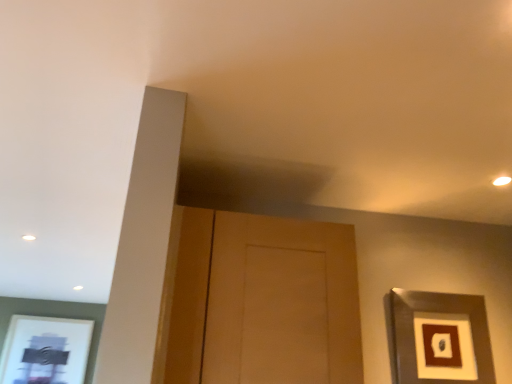
The height and width of the screenshot is (384, 512). Describe the element at coordinates (440, 338) in the screenshot. I see `metallic silver picture frame at upper right` at that location.

The width and height of the screenshot is (512, 384). Find the location of `metallic silver picture frame at upper right`. metallic silver picture frame at upper right is located at coordinates (440, 338).

Measure the distance between point (275, 239) and camera.

Point (275, 239) is 4.26 feet away from camera.

I want to click on wooden door at center, so [282, 302].

The image size is (512, 384). What do you see at coordinates (282, 302) in the screenshot? I see `wooden door at center` at bounding box center [282, 302].

Find the location of a particular element. metallic silver picture frame at upper right is located at coordinates (440, 338).

Does wooden door at center appear on the right side of metallic silver picture frame at upper right?

No, wooden door at center is not to the right of metallic silver picture frame at upper right.

Considering the positions of objects wooden door at center and metallic silver picture frame at upper right in the image provided, who is behind, wooden door at center or metallic silver picture frame at upper right?

Positioned behind is metallic silver picture frame at upper right.

Which is in front, point (285, 360) or point (395, 345)?

The point (285, 360) is more forward.

From the image's perspective, which is below, wooden door at center or metallic silver picture frame at upper right?

metallic silver picture frame at upper right is shown below in the image.

From a real-world perspective, is wooden door at center on metallic silver picture frame at upper right?

Yes.

Which object is wider, wooden door at center or metallic silver picture frame at upper right?

wooden door at center is wider.

Which of these two, wooden door at center or metallic silver picture frame at upper right, stands taller?

wooden door at center is taller.

Considering the relative sizes of wooden door at center and metallic silver picture frame at upper right in the image provided, is wooden door at center smaller than metallic silver picture frame at upper right?

No.

Is metallic silver picture frame at upper right inside wooden door at center?

No, wooden door at center does not contain metallic silver picture frame at upper right.

Are wooden door at center and metallic silver picture frame at upper right beside each other?

wooden door at center is not next to metallic silver picture frame at upper right, and they're not touching.

Is wooden door at center looking in the opposite direction of metallic silver picture frame at upper right?

No, metallic silver picture frame at upper right is not at the back of wooden door at center.

How many degrees apart are the facing directions of wooden door at center and metallic silver picture frame at upper right?

They differ by 1.3 degrees in their facing directions.

This screenshot has width=512, height=384. In order to click on picture frame on the right of wooden door at center in this screenshot , I will do `click(440, 338)`.

Looking at this image, is metallic silver picture frame at upper right to the right of wooden door at center from the viewer's perspective?

Indeed, metallic silver picture frame at upper right is positioned on the right side of wooden door at center.

Considering the positions of objects metallic silver picture frame at upper right and wooden door at center in the image provided, who is in front, metallic silver picture frame at upper right or wooden door at center?

wooden door at center is closer to the camera.

Is point (411, 339) closer to camera compared to point (350, 334)?

That is False.

From the image's perspective, which is above, metallic silver picture frame at upper right or wooden door at center?

wooden door at center, from the image's perspective.

From a real-world perspective, is metallic silver picture frame at upper right physically located above or below wooden door at center?

metallic silver picture frame at upper right is situated lower than wooden door at center in the real world.

Which object is wider, metallic silver picture frame at upper right or wooden door at center?

With larger width is wooden door at center.

Considering the sizes of objects metallic silver picture frame at upper right and wooden door at center in the image provided, who is shorter, metallic silver picture frame at upper right or wooden door at center?

metallic silver picture frame at upper right.

Can you confirm if metallic silver picture frame at upper right is bigger than wooden door at center?

Actually, metallic silver picture frame at upper right might be smaller than wooden door at center.

Do you think metallic silver picture frame at upper right is within wooden door at center, or outside of it?

The correct answer is: outside.

Does metallic silver picture frame at upper right touch wooden door at center?

No, metallic silver picture frame at upper right is not next to wooden door at center.

Does metallic silver picture frame at upper right turn towards wooden door at center?

No, metallic silver picture frame at upper right is not oriented towards wooden door at center.

Locate an element on the screen. picture frame lying on the right of wooden door at center is located at coordinates (440, 338).

Find the location of a particular element. picture frame on the right of wooden door at center is located at coordinates (440, 338).

I want to click on door that is in front of the metallic silver picture frame at upper right, so click(x=282, y=302).